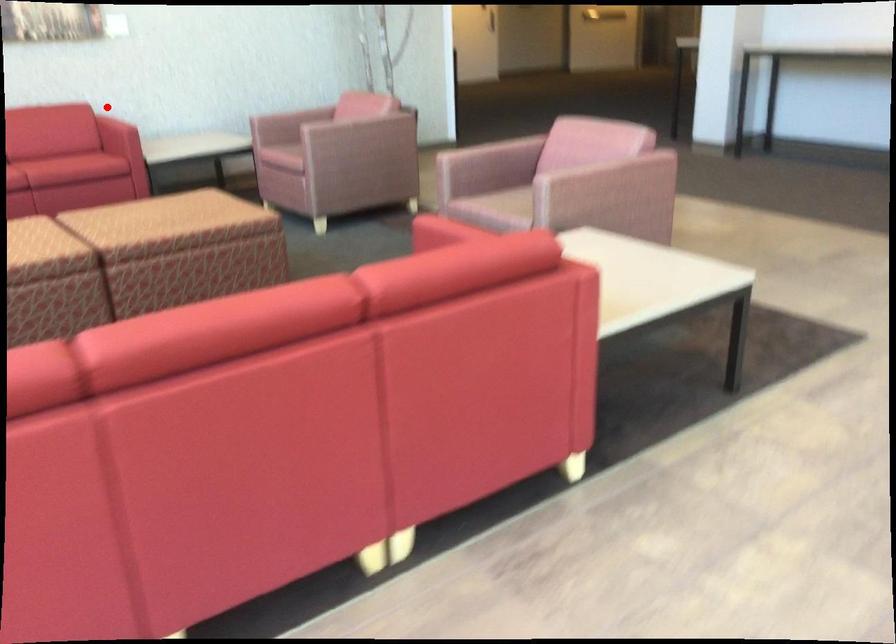
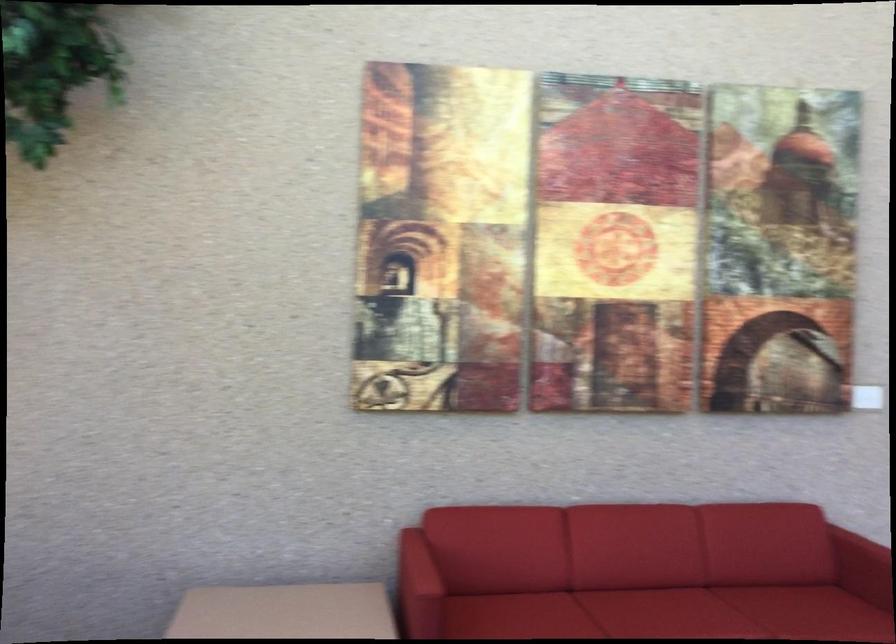
Question: I am providing you with two images of the same scene from different viewpoints. Image1 has a red point marked. In image2, the corresponding 3D location appears at what relative position? Reply with the corresponding letter.

Choices:
 (A) Closer
 (B) Farther

Answer: (A)